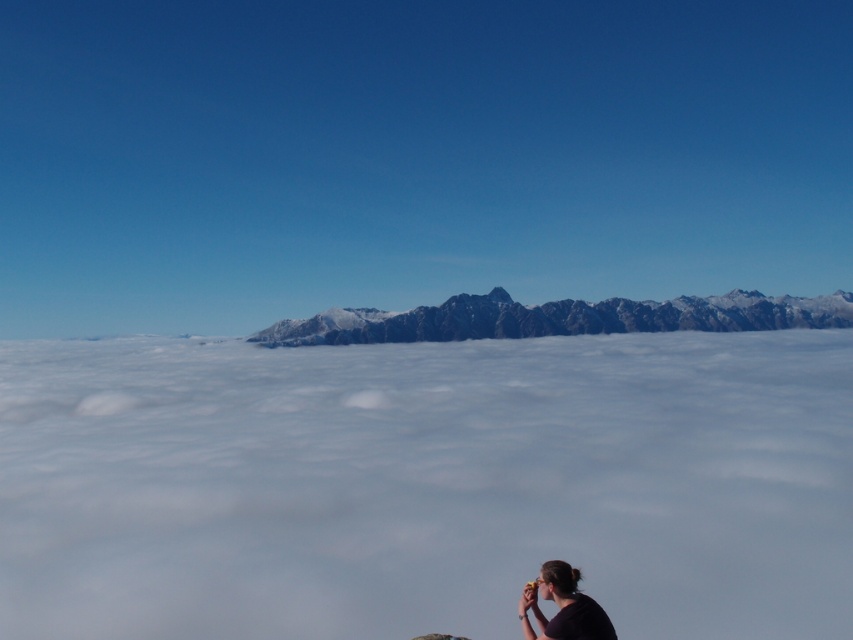
Can you confirm if snowy rocky mountains at center is shorter than black matte shirt at lower right?

No.

Can you confirm if snowy rocky mountains at center is positioned to the left of black matte shirt at lower right?

Incorrect, snowy rocky mountains at center is not on the left side of black matte shirt at lower right.

Where is `snowy rocky mountains at center`? This screenshot has width=853, height=640. snowy rocky mountains at center is located at coordinates (558, 317).

Can you confirm if white fluffy cloud at center is bigger than snowy rocky mountains at center?

Yes.

Is point (283, 429) positioned after point (763, 298)?

No, it is not.

Does point (283, 592) come in front of point (508, 298)?

Yes.

Where is `white fluffy cloud at center`? This screenshot has width=853, height=640. white fluffy cloud at center is located at coordinates (425, 484).

Is point (196, 634) less distant than point (585, 600)?

That is False.

Which is above, white fluffy cloud at center or black matte shirt at lower right?

black matte shirt at lower right

Identify the location of white fluffy cloud at center. This screenshot has width=853, height=640. (425, 484).